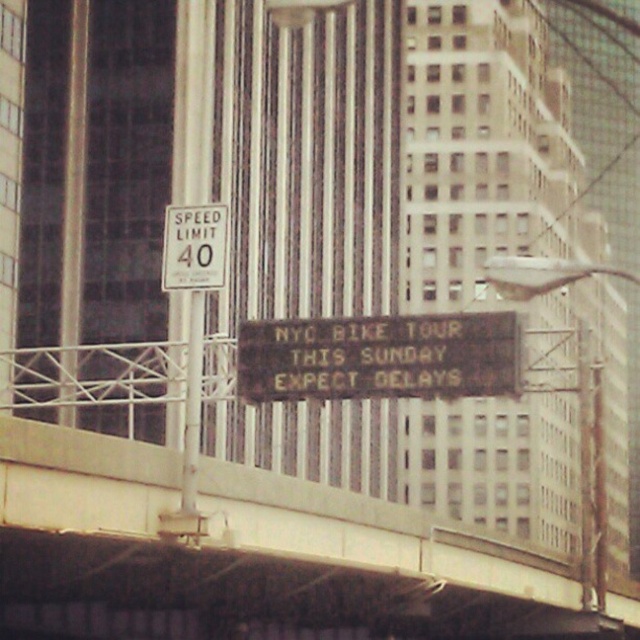
Between black plastic electronic display at center and white plastic speed limit sign at upper center, which one is positioned higher?

Positioned higher is white plastic speed limit sign at upper center.

Is point (378, 317) in front of point (168, 244)?

No, (378, 317) is further to viewer.

Between point (401, 396) and point (221, 208), which one is positioned in front?

Point (221, 208)

At what (x,y) coordinates should I click in order to perform the action: click on black plastic electronic display at center. Please return your answer as a coordinate pair (x, y). Looking at the image, I should click on (380, 356).